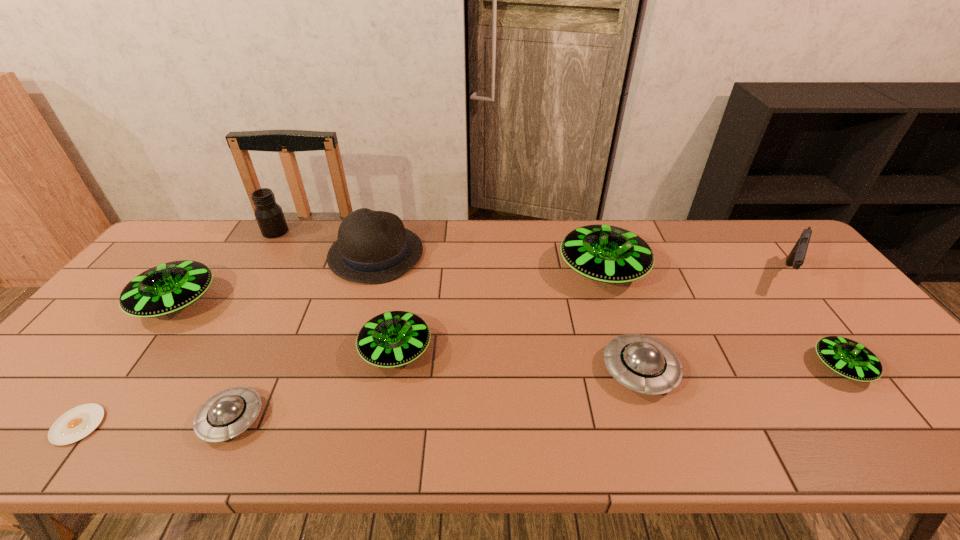
Locate an element on the screen. Image resolution: width=960 pixels, height=540 pixels. saucer that is at the near edge is located at coordinates (225, 415).

At what (x,y) coordinates should I click in order to perform the action: click on egg yolk at the near edge. Please return your answer as a coordinate pair (x, y). Looking at the image, I should click on (77, 423).

Locate an element on the screen. This screenshot has height=540, width=960. saucer at the left edge is located at coordinates (167, 288).

Where is `egg yolk that is at the left edge`? This screenshot has width=960, height=540. egg yolk that is at the left edge is located at coordinates (77, 423).

Find the location of a particular element. Image resolution: width=960 pixels, height=540 pixels. gun that is at the right edge is located at coordinates (796, 257).

This screenshot has height=540, width=960. Identify the location of saucer positioned at the right edge. (850, 359).

Where is `object located in the near left corner section of the desktop`? object located in the near left corner section of the desktop is located at coordinates pos(77,423).

Identify the location of object that is at the far right corner. Image resolution: width=960 pixels, height=540 pixels. (796, 257).

Image resolution: width=960 pixels, height=540 pixels. In order to click on free region at the far edge of the desktop in this screenshot , I will do `click(300, 231)`.

Locate an element on the screen. Image resolution: width=960 pixels, height=540 pixels. free point at the near edge is located at coordinates (627, 415).